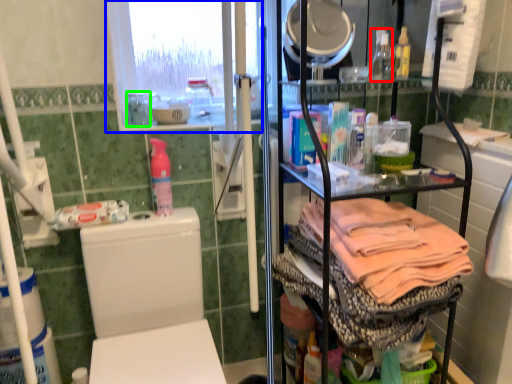
Question: Based on their relative distances, which object is farther from bottle (highlighted by a red box)? Choose from window screen (highlighted by a blue box) and bottle (highlighted by a green box).

Choices:
 (A) window screen
 (B) bottle

Answer: (B)